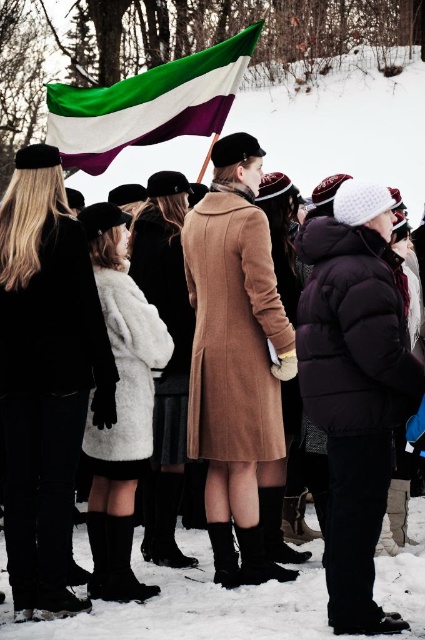
Is suede tan coat at center bigger than fuzzy white coat at center?

Actually, suede tan coat at center might be smaller than fuzzy white coat at center.

Is point (189, 268) farther from viewer compared to point (184, 561)?

Yes, point (189, 268) is behind point (184, 561).

Who is more forward, (x=277, y=376) or (x=167, y=444)?

Point (x=277, y=376)

At what (x,y) coordinates should I click in order to perform the action: click on suede tan coat at center. Please return your answer as a coordinate pair (x, y). This screenshot has width=425, height=640. Looking at the image, I should click on (235, 356).

Between point (388, 477) and point (144, 230), which one is positioned behind?

The point (144, 230) is more distant.

Looking at this image, who is positioned more to the right, matte black coat at center or fuzzy white coat at center?

matte black coat at center is more to the right.

Between point (345, 204) and point (175, 445), which one is positioned behind?

Positioned behind is point (175, 445).

The height and width of the screenshot is (640, 425). I want to click on matte black coat at center, so click(x=354, y=387).

Can you confirm if white fur coat at center is thinner than fuzzy white coat at center?

Indeed, white fur coat at center has a lesser width compared to fuzzy white coat at center.

Is point (144, 586) closer to camera compared to point (178, 340)?

Yes, it is in front of point (178, 340).

Is point (107, 532) closer to camera compared to point (158, 561)?

Yes, it is in front of point (158, 561).

Identify the location of white fur coat at center. (121, 406).